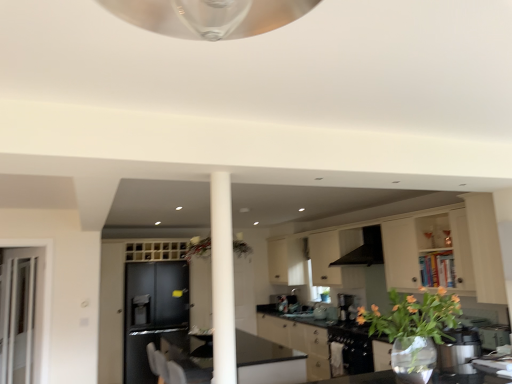
Question: From the image's perspective, is translucent glass vase at lower right below black matte exhaust hood at center?

Choices:
 (A) yes
 (B) no

Answer: (A)

Question: Does translucent glass vase at lower right come behind black matte exhaust hood at center?

Choices:
 (A) no
 (B) yes

Answer: (A)

Question: From a real-world perspective, is translucent glass vase at lower right below black matte exhaust hood at center?

Choices:
 (A) no
 (B) yes

Answer: (B)

Question: Does translucent glass vase at lower right have a lesser width compared to black matte exhaust hood at center?

Choices:
 (A) no
 (B) yes

Answer: (B)

Question: Is translucent glass vase at lower right aimed at black matte exhaust hood at center?

Choices:
 (A) no
 (B) yes

Answer: (B)

Question: Is matte white cabinets at center, positioned as the 3th cabinetry in left-to-right order, wider or thinner than satin black coffee machine at center?

Choices:
 (A) thin
 (B) wide

Answer: (B)

Question: Based on their sizes in the image, would you say matte white cabinets at center, acting as the 1th cabinetry starting from the right, is bigger or smaller than satin black coffee machine at center?

Choices:
 (A) big
 (B) small

Answer: (A)

Question: In the image, is matte white cabinets at center, positioned as the 3th cabinetry in left-to-right order, positioned in front of or behind satin black coffee machine at center?

Choices:
 (A) front
 (B) behind

Answer: (A)

Question: From their relative heights in the image, would you say matte white cabinets at center, positioned as the 3th cabinetry in left-to-right order, is taller or shorter than satin black coffee machine at center?

Choices:
 (A) tall
 (B) short

Answer: (A)

Question: From a real-world perspective, is transparent glass table at lower right above or below black matte exhaust hood at center?

Choices:
 (A) below
 (B) above

Answer: (A)

Question: Relative to black matte exhaust hood at center, is transparent glass table at lower right in front or behind?

Choices:
 (A) front
 (B) behind

Answer: (A)

Question: From the image's perspective, is transparent glass table at lower right positioned above or below black matte exhaust hood at center?

Choices:
 (A) below
 (B) above

Answer: (A)

Question: Considering the positions of transparent glass table at lower right and black matte exhaust hood at center in the image, is transparent glass table at lower right bigger or smaller than black matte exhaust hood at center?

Choices:
 (A) small
 (B) big

Answer: (A)

Question: Which is correct: matte black cabinet at left, which ranks as the first cabinetry in left-to-right order, is inside matte white cabinets at center, positioned as the 3th cabinetry in left-to-right order, or outside of it?

Choices:
 (A) outside
 (B) inside

Answer: (A)

Question: Based on their sizes in the image, would you say matte black cabinet at left, which ranks as the first cabinetry in left-to-right order, is bigger or smaller than matte white cabinets at center, acting as the 1th cabinetry starting from the right?

Choices:
 (A) big
 (B) small

Answer: (B)